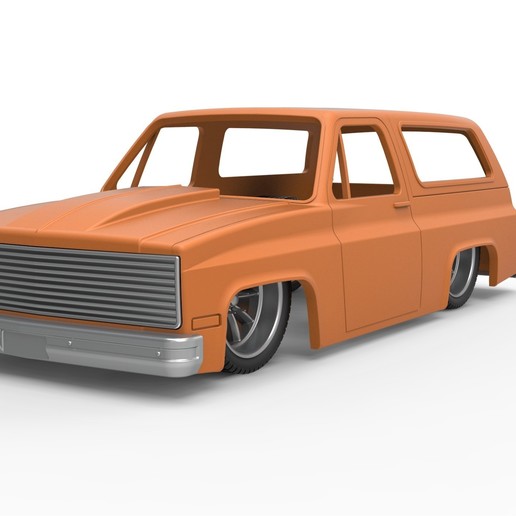
The height and width of the screenshot is (516, 516). Identify the location of hood. (30, 213), (146, 227), (233, 209), (106, 195).